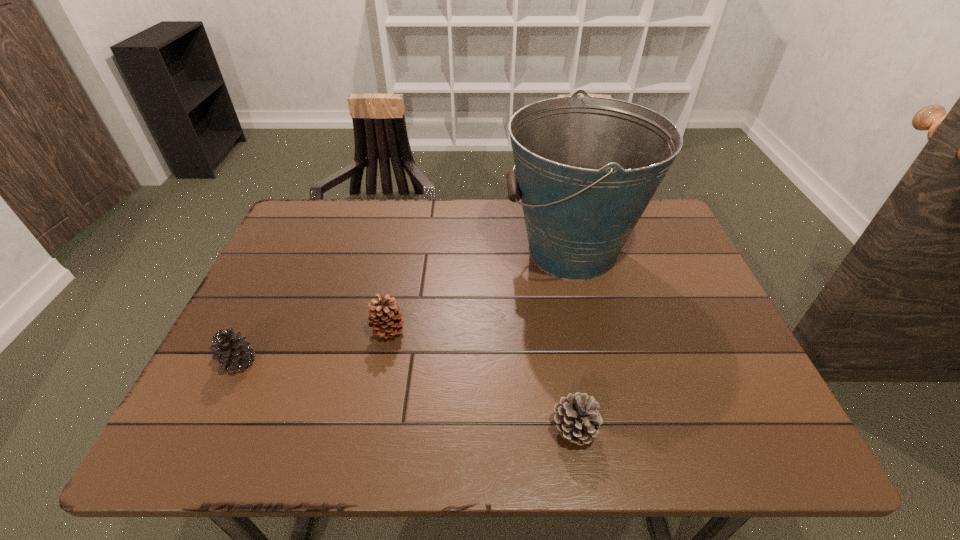
Find the location of `free spot between the second nearest pinecone and the bucket`. free spot between the second nearest pinecone and the bucket is located at coordinates (406, 307).

Locate an element on the screen. Image resolution: width=960 pixels, height=540 pixels. unoccupied area between the second tallest object and the rightmost pinecone is located at coordinates (481, 380).

Find the location of a particular element. free space between the second nearest pinecone and the bucket is located at coordinates (406, 307).

Where is `vacant area that lies between the nearest pinecone and the tallest pinecone`? This screenshot has width=960, height=540. vacant area that lies between the nearest pinecone and the tallest pinecone is located at coordinates (481, 380).

This screenshot has height=540, width=960. Identify the location of vacant space that's between the second pinecone from left to right and the leftmost object. (314, 346).

The image size is (960, 540). I want to click on the second closest object relative to the second pinecone from left to right, so click(586, 168).

Locate an element on the screen. the closest object to the farthest object is located at coordinates (383, 318).

Locate an element on the screen. Image resolution: width=960 pixels, height=540 pixels. the closest pinecone to the second nearest pinecone is located at coordinates (383, 318).

Locate an element on the screen. pinecone that is the third closest to the bucket is located at coordinates (233, 352).

The width and height of the screenshot is (960, 540). I want to click on free spot that satisfies the following two spatial constraints: 1. with the handle on opposite sides of the bucket; 2. on the front side of the nearest pinecone, so click(x=614, y=429).